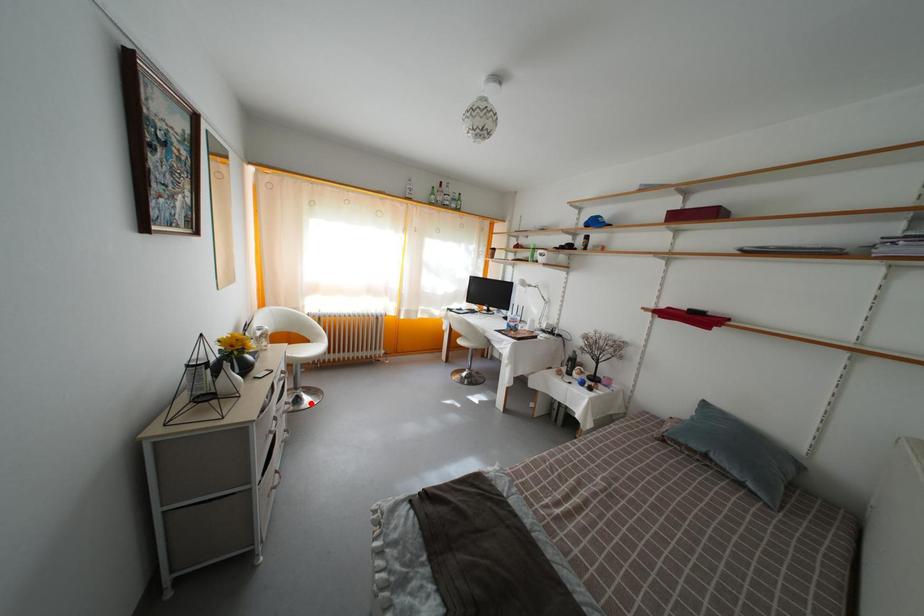
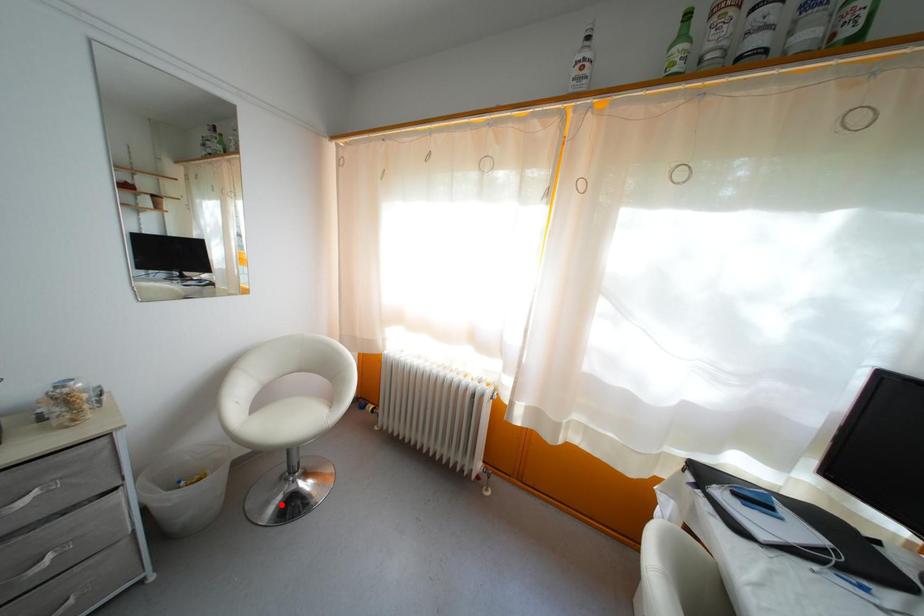
I am providing you with two images of the same scene from different viewpoints. A red point is marked on the first image and another point is marked on the second image. Does the point marked in image1 correspond to the same location as the one in image2?

Yes